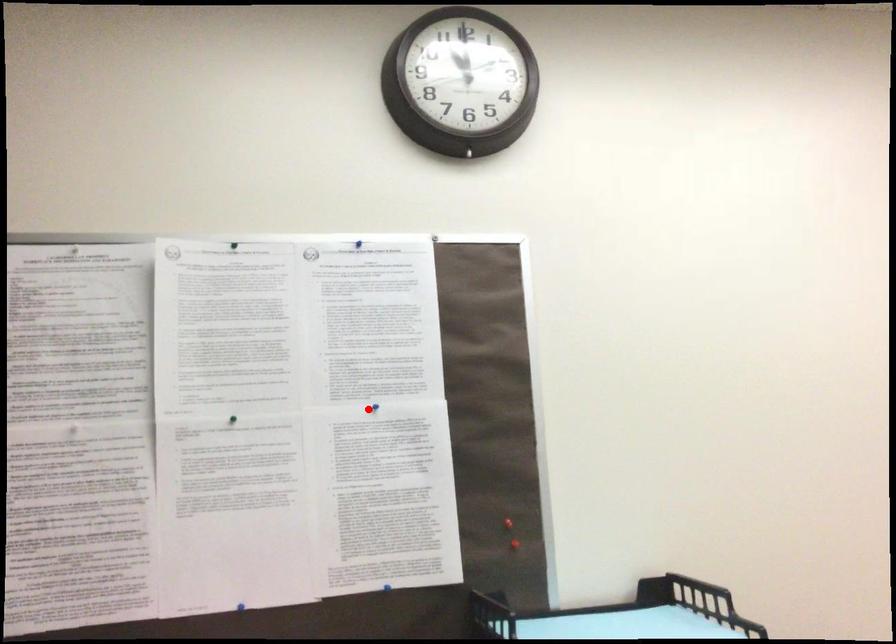
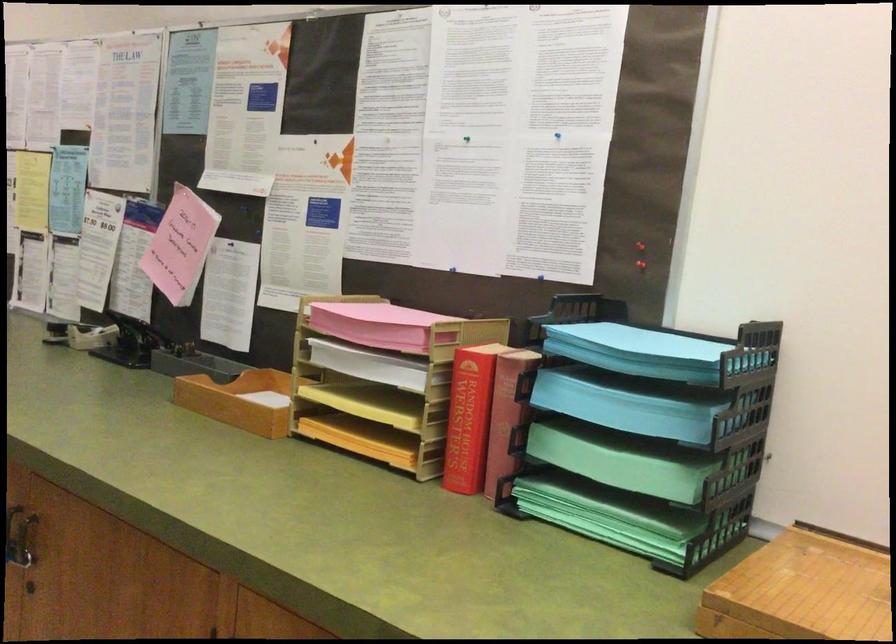
Find the pixel in the second image that matches the highlighted location in the first image.

(556, 135)